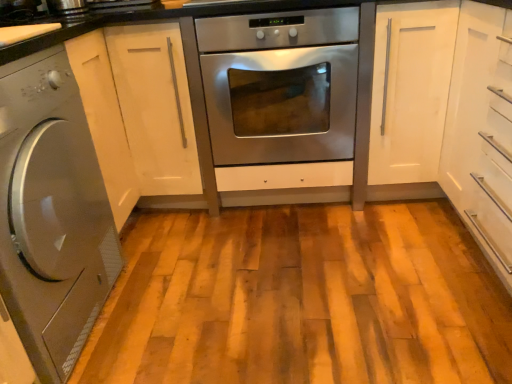
Question: Is stainless steel oven at center wider than white matte cabinet at right, the 1th cabinetry from the right?

Choices:
 (A) yes
 (B) no

Answer: (A)

Question: Can you confirm if stainless steel oven at center is smaller than white matte cabinet at right, which is counted as the 2th cabinetry, starting from the left?

Choices:
 (A) no
 (B) yes

Answer: (A)

Question: Is stainless steel oven at center far away from white matte cabinet at right, which is counted as the 2th cabinetry, starting from the left?

Choices:
 (A) yes
 (B) no

Answer: (B)

Question: From the image's perspective, is stainless steel oven at center located beneath white matte cabinet at right, which is counted as the 2th cabinetry, starting from the left?

Choices:
 (A) yes
 (B) no

Answer: (B)

Question: Is stainless steel oven at center at the right side of white matte cabinet at right, which is counted as the 2th cabinetry, starting from the left?

Choices:
 (A) yes
 (B) no

Answer: (B)

Question: Considering the positions of point (108, 130) and point (470, 203), is point (108, 130) closer or farther from the camera than point (470, 203)?

Choices:
 (A) closer
 (B) farther

Answer: (B)

Question: From a real-world perspective, relative to white matte cabinet at right, the 1th cabinetry from the right, is white glossy cabinet at center, which is counted as the first cabinetry, starting from the left, vertically above or below?

Choices:
 (A) below
 (B) above

Answer: (B)

Question: In the image, is white glossy cabinet at center, which is counted as the first cabinetry, starting from the left, on the left side or the right side of white matte cabinet at right, the 1th cabinetry from the right?

Choices:
 (A) left
 (B) right

Answer: (A)

Question: In terms of height, does white glossy cabinet at center, which is counted as the first cabinetry, starting from the left, look taller or shorter compared to white matte cabinet at right, which is counted as the 2th cabinetry, starting from the left?

Choices:
 (A) tall
 (B) short

Answer: (A)

Question: Do you think satin silver washing machine at left is within white matte cabinet at right, which is counted as the 2th cabinetry, starting from the left, or outside of it?

Choices:
 (A) inside
 (B) outside

Answer: (B)

Question: In the image, is satin silver washing machine at left on the left side or the right side of white matte cabinet at right, which is counted as the 2th cabinetry, starting from the left?

Choices:
 (A) left
 (B) right

Answer: (A)

Question: In the image, is satin silver washing machine at left positioned in front of or behind white matte cabinet at right, which is counted as the 2th cabinetry, starting from the left?

Choices:
 (A) front
 (B) behind

Answer: (A)

Question: From the image's perspective, is satin silver washing machine at left located above or below white matte cabinet at right, the 1th cabinetry from the right?

Choices:
 (A) below
 (B) above

Answer: (A)

Question: Do you think stainless steel oven at center is within white glossy cabinet at center, which is counted as the first cabinetry, starting from the left, or outside of it?

Choices:
 (A) outside
 (B) inside

Answer: (A)

Question: Considering the positions of stainless steel oven at center and white glossy cabinet at center, which is counted as the first cabinetry, starting from the left, in the image, is stainless steel oven at center taller or shorter than white glossy cabinet at center, which is counted as the first cabinetry, starting from the left,?

Choices:
 (A) tall
 (B) short

Answer: (B)